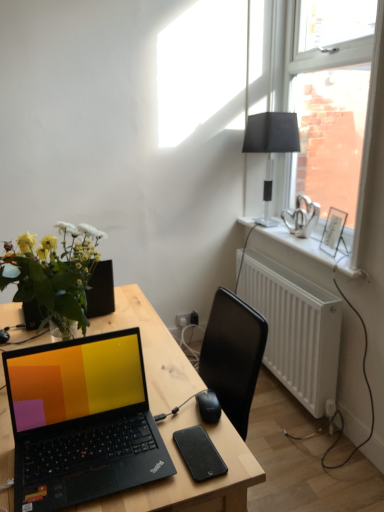
Question: From a real-world perspective, is black matte lampshade at upper right beneath black plastic mouse at center?

Choices:
 (A) yes
 (B) no

Answer: (B)

Question: Is black matte lampshade at upper right positioned in front of black plastic mouse at center?

Choices:
 (A) yes
 (B) no

Answer: (B)

Question: Is black matte lampshade at upper right thinner than black plastic mouse at center?

Choices:
 (A) yes
 (B) no

Answer: (B)

Question: Is black matte lampshade at upper right facing towards black plastic mouse at center?

Choices:
 (A) yes
 (B) no

Answer: (B)

Question: Does black matte lampshade at upper right appear on the left side of black plastic mouse at center?

Choices:
 (A) yes
 (B) no

Answer: (B)

Question: Looking at the image, does white plastic radiator at lower right seem bigger or smaller compared to white painted wood at upper right?

Choices:
 (A) big
 (B) small

Answer: (A)

Question: Relative to white painted wood at upper right, is white plastic radiator at lower right in front or behind?

Choices:
 (A) behind
 (B) front

Answer: (A)

Question: Considering the positions of white plastic radiator at lower right and white painted wood at upper right in the image, is white plastic radiator at lower right taller or shorter than white painted wood at upper right?

Choices:
 (A) short
 (B) tall

Answer: (B)

Question: From the image's perspective, is white plastic radiator at lower right above or below white painted wood at upper right?

Choices:
 (A) above
 (B) below

Answer: (B)

Question: Considering the positions of black plastic mouse at center and black matte tablet at center in the image, is black plastic mouse at center bigger or smaller than black matte tablet at center?

Choices:
 (A) big
 (B) small

Answer: (A)

Question: Considering the positions of black plastic mouse at center and black matte tablet at center in the image, is black plastic mouse at center taller or shorter than black matte tablet at center?

Choices:
 (A) tall
 (B) short

Answer: (A)

Question: Is black plastic mouse at center wider or thinner than black matte tablet at center?

Choices:
 (A) thin
 (B) wide

Answer: (A)

Question: From the image's perspective, is black plastic mouse at center located above or below black matte tablet at center?

Choices:
 (A) above
 (B) below

Answer: (A)

Question: Is white plastic radiator at lower right bigger or smaller than black plastic mouse at center?

Choices:
 (A) small
 (B) big

Answer: (B)

Question: In the image, is white plastic radiator at lower right positioned in front of or behind black plastic mouse at center?

Choices:
 (A) front
 (B) behind

Answer: (B)